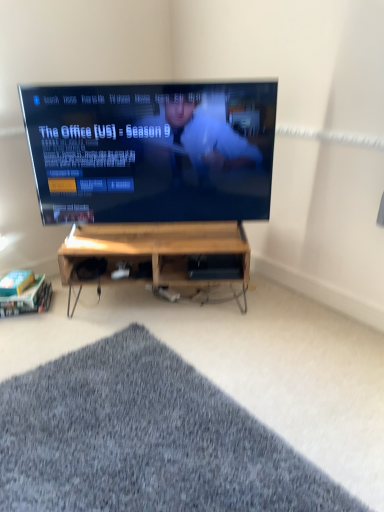
Describe the element at coordinates (159, 259) in the screenshot. I see `woodenmaterial/texturedesk at center` at that location.

The image size is (384, 512). What do you see at coordinates (28, 298) in the screenshot?
I see `woodenmaterial/textureshelf at lower left, acting as the second shelf starting from the top` at bounding box center [28, 298].

How much space does woodenmaterial/textureshelf at lower left, which is the first shelf from bottom to top, occupy horizontally?

woodenmaterial/textureshelf at lower left, which is the first shelf from bottom to top, is 10.70 inches in width.

Where is `woodenmaterial/texturedesk at center`? This screenshot has height=512, width=384. woodenmaterial/texturedesk at center is located at coordinates (159, 259).

Considering the positions of objects woodenmaterial/textureshelf at lower left, which is the first shelf from bottom to top, and woodenmaterial/texturedesk at center in the image provided, who is more to the right, woodenmaterial/textureshelf at lower left, which is the first shelf from bottom to top, or woodenmaterial/texturedesk at center?

woodenmaterial/texturedesk at center is more to the right.

Can you tell me how much woodenmaterial/textureshelf at lower left, positioned as the 2th shelf in right-to-left order, and woodenmaterial/texturedesk at center differ in facing direction?

11.2 degrees separate the facing orientations of woodenmaterial/textureshelf at lower left, positioned as the 2th shelf in right-to-left order, and woodenmaterial/texturedesk at center.

Is point (51, 297) closer or farther from the camera than point (164, 297)?

Point (51, 297).

Is woodenmaterial/textureshelf at lower left, which appears as the 1th shelf when viewed from the left, smaller than woodenmaterial/texturedesk at center?

Yes, woodenmaterial/textureshelf at lower left, which appears as the 1th shelf when viewed from the left, is smaller than woodenmaterial/texturedesk at center.

Considering the relative positions of woodenmaterial/texturedesk at center and gray shaggy rug at lower center in the image provided, is woodenmaterial/texturedesk at center to the left or to the right of gray shaggy rug at lower center?

In the image, woodenmaterial/texturedesk at center appears on the right side of gray shaggy rug at lower center.

What's the angular difference between woodenmaterial/texturedesk at center and gray shaggy rug at lower center's facing directions?

The angle between the facing direction of woodenmaterial/texturedesk at center and the facing direction of gray shaggy rug at lower center is 51.5 degrees.

Is woodenmaterial/texturedesk at center situated inside gray shaggy rug at lower center or outside?

woodenmaterial/texturedesk at center lies outside gray shaggy rug at lower center.

Is woodenmaterial/texturedesk at center far from gray shaggy rug at lower center?

No, woodenmaterial/texturedesk at center is not far away from gray shaggy rug at lower center.

Which of these two, woodenmaterial/texturedesk at center or black glossy tv at center, stands taller?

black glossy tv at center is taller.

Between point (209, 261) and point (269, 82), which one is positioned in front?

The point (269, 82) is more forward.

From the image's perspective, is woodenmaterial/texturedesk at center under black glossy tv at center?

Indeed, from the image's perspective, woodenmaterial/texturedesk at center is shown beneath black glossy tv at center.

What's the angular difference between woodenmaterial/texturedesk at center and black glossy tv at center's facing directions?

The angular difference between woodenmaterial/texturedesk at center and black glossy tv at center is 4.59e-05 degrees.

From the picture: Is black glossy tv at center looking in the opposite direction of woodenmaterial/textureshelf at lower left, acting as the second shelf starting from the top?

No, black glossy tv at center's orientation is not away from woodenmaterial/textureshelf at lower left, acting as the second shelf starting from the top.

Is there a large distance between black glossy tv at center and woodenmaterial/textureshelf at lower left, which is the first shelf from bottom to top?

That's not correct — black glossy tv at center is a little close to woodenmaterial/textureshelf at lower left, which is the first shelf from bottom to top.

Considering the positions of objects black glossy tv at center and woodenmaterial/textureshelf at lower left, acting as the second shelf starting from the top, in the image provided, who is behind, black glossy tv at center or woodenmaterial/textureshelf at lower left, acting as the second shelf starting from the top,?

woodenmaterial/textureshelf at lower left, acting as the second shelf starting from the top, is behind.

Consider the image. Is black glossy tv at center located outside woodenmaterial/textureshelf at lower left, which is the first shelf from bottom to top?

Yes, black glossy tv at center is not within woodenmaterial/textureshelf at lower left, which is the first shelf from bottom to top.

What's the angular difference between gray shaggy rug at lower center and woodenmaterial/textureshelf at lower left, which is the first shelf from bottom to top,'s facing directions?

The angle between the facing direction of gray shaggy rug at lower center and the facing direction of woodenmaterial/textureshelf at lower left, which is the first shelf from bottom to top, is 62.8 degrees.

In the scene shown: Is gray shaggy rug at lower center not inside woodenmaterial/textureshelf at lower left, which is the first shelf from bottom to top?

Yes, gray shaggy rug at lower center is not within woodenmaterial/textureshelf at lower left, which is the first shelf from bottom to top.

Is gray shaggy rug at lower center far away from woodenmaterial/textureshelf at lower left, acting as the second shelf starting from the top?

Yes, gray shaggy rug at lower center and woodenmaterial/textureshelf at lower left, acting as the second shelf starting from the top, are quite far apart.

Between gray shaggy rug at lower center and woodenmaterial/textureshelf at lower left, which is the first shelf from bottom to top, which one has less height?

gray shaggy rug at lower center.

Based on the photo, which of these two, wooden at center, positioned as the first shelf in top-to-bottom order, or woodenmaterial/textureshelf at lower left, which is the first shelf from bottom to top, is thinner?

With smaller width is woodenmaterial/textureshelf at lower left, which is the first shelf from bottom to top.

What's the angular difference between wooden at center, positioned as the 1th shelf in right-to-left order, and woodenmaterial/textureshelf at lower left, which is the first shelf from bottom to top,'s facing directions?

The angular difference between wooden at center, positioned as the 1th shelf in right-to-left order, and woodenmaterial/textureshelf at lower left, which is the first shelf from bottom to top, is 11.2 degrees.

Consider the image. Would you say wooden at center, acting as the second shelf starting from the bottom, is a long distance from woodenmaterial/textureshelf at lower left, which appears as the 1th shelf when viewed from the left?

No.

Is wooden at center, which is the 2th shelf in left-to-right order, completely or partially outside of black glossy tv at center?

wooden at center, which is the 2th shelf in left-to-right order, is positioned outside black glossy tv at center.

Is wooden at center, positioned as the 1th shelf in right-to-left order, in contact with black glossy tv at center?

No, wooden at center, positioned as the 1th shelf in right-to-left order, is not next to black glossy tv at center.

Considering the sizes of objects wooden at center, positioned as the 1th shelf in right-to-left order, and black glossy tv at center in the image provided, who is taller, wooden at center, positioned as the 1th shelf in right-to-left order, or black glossy tv at center?

Standing taller between the two is black glossy tv at center.

Does point (212, 270) lie in front of point (108, 100)?

No, it is not.

The height and width of the screenshot is (512, 384). Find the location of `desk in front of the woodenmaterial/textureshelf at lower left, positioned as the 2th shelf in right-to-left order`. desk in front of the woodenmaterial/textureshelf at lower left, positioned as the 2th shelf in right-to-left order is located at coordinates (159, 259).

In the image, there is a woodenmaterial/texturedesk at center. Where is `mat below it (from a real-world perspective)`? mat below it (from a real-world perspective) is located at coordinates (144, 439).

When comparing their distances from woodenmaterial/texturedesk at center, does wooden at center, positioned as the first shelf in top-to-bottom order, or woodenmaterial/textureshelf at lower left, acting as the second shelf starting from the top, seem further?

The object further to woodenmaterial/texturedesk at center is woodenmaterial/textureshelf at lower left, acting as the second shelf starting from the top.

Considering their positions, is woodenmaterial/textureshelf at lower left, which appears as the 1th shelf when viewed from the left, positioned further to wooden at center, which is the 2th shelf in left-to-right order, than black glossy tv at center?

Based on the image, woodenmaterial/textureshelf at lower left, which appears as the 1th shelf when viewed from the left, appears to be further to wooden at center, which is the 2th shelf in left-to-right order.

When comparing their distances from black glossy tv at center, does woodenmaterial/texturedesk at center or gray shaggy rug at lower center seem further?

gray shaggy rug at lower center.

Based on their spatial positions, is woodenmaterial/texturedesk at center or woodenmaterial/textureshelf at lower left, which is the first shelf from bottom to top, closer to black glossy tv at center?

woodenmaterial/texturedesk at center is closer to black glossy tv at center.

Looking at the image, which one is located closer to woodenmaterial/textureshelf at lower left, which is the first shelf from bottom to top, wooden at center, which is the 2th shelf in left-to-right order, or woodenmaterial/texturedesk at center?

Among the two, woodenmaterial/texturedesk at center is located nearer to woodenmaterial/textureshelf at lower left, which is the first shelf from bottom to top.

Estimate the real-world distances between objects in this image. Which object is further from black glossy tv at center, gray shaggy rug at lower center or woodenmaterial/texturedesk at center?

The object further to black glossy tv at center is gray shaggy rug at lower center.

When comparing their distances from black glossy tv at center, does wooden at center, positioned as the first shelf in top-to-bottom order, or gray shaggy rug at lower center seem further?

gray shaggy rug at lower center.

From the image, which object appears to be farther from gray shaggy rug at lower center, black glossy tv at center or woodenmaterial/texturedesk at center?

black glossy tv at center lies further to gray shaggy rug at lower center than the other object.

This screenshot has height=512, width=384. I want to click on television between woodenmaterial/textureshelf at lower left, positioned as the 2th shelf in right-to-left order, and woodenmaterial/texturedesk at center, so click(x=151, y=151).

You are a GUI agent. You are given a task and a screenshot of the screen. Output one action in this format:
    pyautogui.click(x=<x>, y=<y>)
    Task: Click on the television between gray shaggy rug at lower center and woodenmaterial/texturedesk at center along the z-axis
    The image size is (384, 512).
    Given the screenshot: What is the action you would take?
    pyautogui.click(x=151, y=151)

Locate an element on the screen. Image resolution: width=384 pixels, height=512 pixels. desk between gray shaggy rug at lower center and wooden at center, which is the 2th shelf in left-to-right order, in the front-back direction is located at coordinates (159, 259).

I want to click on desk between gray shaggy rug at lower center and woodenmaterial/textureshelf at lower left, which appears as the 1th shelf when viewed from the left, along the z-axis, so click(159, 259).